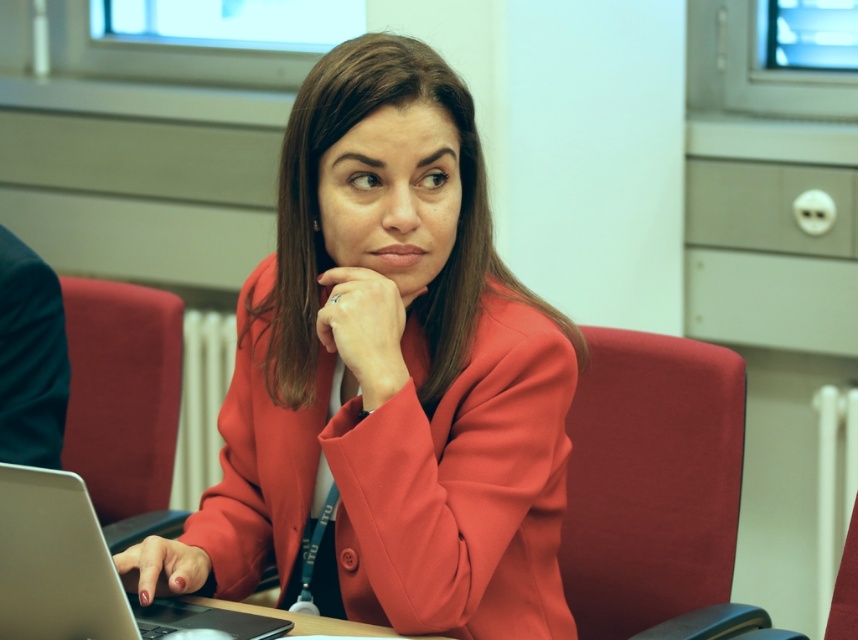
You are an interior designer assessing the space in the image. The matte red blazer at center and the silver metallic laptop at lower left are both on the table. Can you determine which object occupies more horizontal space on the table?

The matte red blazer at center has a larger width than the silver metallic laptop at lower left, so it occupies more horizontal space on the table.

You are an interior designer analyzing the placement of objects in the image. The point at coordinates (388, 378) is marked. Which object in the scene does this point correspond to?

The point at coordinates (388, 378) corresponds to the matte red blazer at center, as stated in the objects description.

You are an interior designer assessing the placement of items in the room. The matte red blazer at center and the silver metallic laptop at lower left are both on the same table. Which object would cast a longer shadow if the light source is coming from above?

The matte red blazer at center is taller than the silver metallic laptop at lower left, so it would cast a longer shadow.